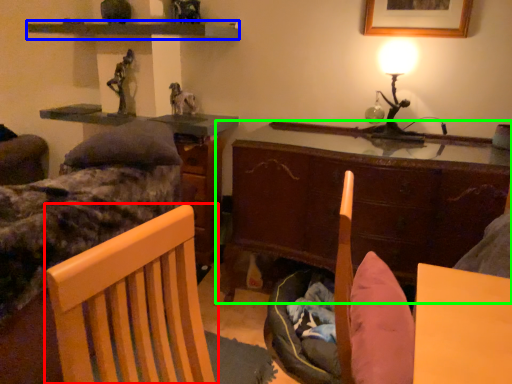
Question: Which object is positioned closest to chair (highlighted by a red box)? Select from shelf (highlighted by a blue box) and cabinetry (highlighted by a green box).

Choices:
 (A) shelf
 (B) cabinetry

Answer: (B)